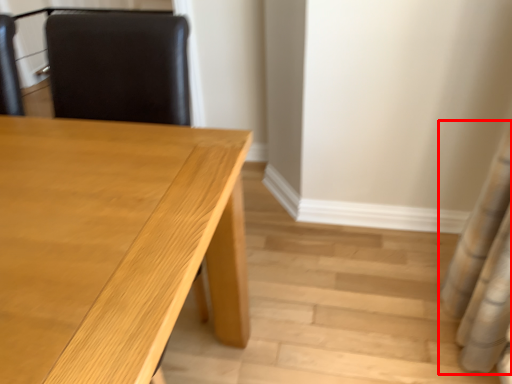
Question: Observing the image, what is the correct spatial positioning of shower curtain (annotated by the red box) in reference to table?

Choices:
 (A) right
 (B) left

Answer: (A)